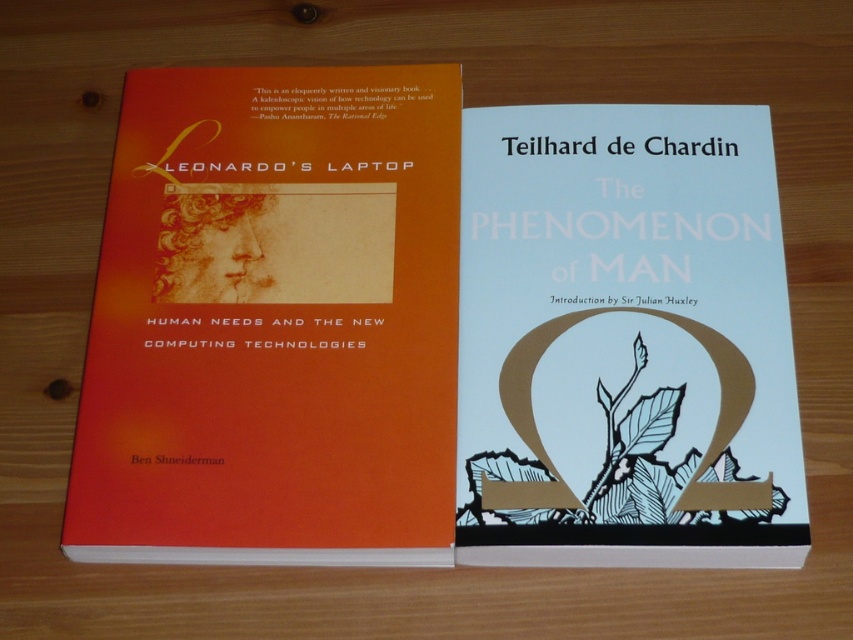
Is orange matte book cover at left below white paper book at center?

No, orange matte book cover at left is not below white paper book at center.

Is point (172, 524) positioned after point (474, 284)?

No.

At what (x,y) coordinates should I click in order to perform the action: click on orange matte book cover at left. Please return your answer as a coordinate pair (x, y). Image resolution: width=853 pixels, height=640 pixels. Looking at the image, I should click on (274, 321).